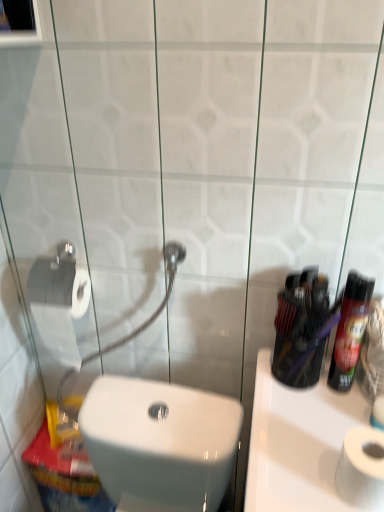
Where is `white glossy sink at right`? white glossy sink at right is located at coordinates (298, 442).

The image size is (384, 512). What do you see at coordinates (160, 443) in the screenshot?
I see `white glossy toilet at lower left` at bounding box center [160, 443].

The image size is (384, 512). Describe the element at coordinates (350, 330) in the screenshot. I see `shiny black spray can at right` at that location.

You are a GUI agent. You are given a task and a screenshot of the screen. Output one action in this format:
    pyautogui.click(x=<x>, y=<y>)
    Task: Click on the shiny black spray can at right
    The width and height of the screenshot is (384, 512).
    Given the screenshot: What is the action you would take?
    pyautogui.click(x=350, y=330)

Where is `translucent plastic mouthwash at center`? Image resolution: width=384 pixels, height=512 pixels. translucent plastic mouthwash at center is located at coordinates (300, 327).

You are a GUI agent. You are given a task and a screenshot of the screen. Output one action in this format:
    pyautogui.click(x=<x>, y=<y>)
    Task: Click on the white glossy sink at right
    
    Given the screenshot: What is the action you would take?
    pyautogui.click(x=298, y=442)

Between translucent plastic mouthwash at center and white glossy toilet at lower left, which one has larger size?

Bigger between the two is white glossy toilet at lower left.

Consider the image. How distant is translucent plastic mouthwash at center from white glossy toilet at lower left?

translucent plastic mouthwash at center and white glossy toilet at lower left are 12.53 inches apart from each other.

This screenshot has width=384, height=512. I want to click on toilet located underneath the translucent plastic mouthwash at center (from a real-world perspective), so click(x=160, y=443).

In the scene shown: Is translucent plastic mouthwash at center taller than white glossy toilet at lower left?

In fact, translucent plastic mouthwash at center may be shorter than white glossy toilet at lower left.

In the scene shown: Could you tell me if white glossy sink at right is turned towards shiny black spray can at right?

No, white glossy sink at right is not oriented towards shiny black spray can at right.

Considering the points (311, 478) and (358, 336), which point is in front, point (311, 478) or point (358, 336)?

Positioned in front is point (311, 478).

Considering the sizes of objects white glossy sink at right and shiny black spray can at right in the image provided, who is thinner, white glossy sink at right or shiny black spray can at right?

shiny black spray can at right is thinner.

From a real-world perspective, which object stands above the other?

In real-world perspective, shiny black spray can at right is above.

From a real-world perspective, does white glossy sink at right sit lower than white matte toilet paper at lower right?

Indeed, from a real-world perspective, white glossy sink at right is positioned beneath white matte toilet paper at lower right.

How far apart are white glossy sink at right and white matte toilet paper at lower right?

white glossy sink at right and white matte toilet paper at lower right are 5.07 inches apart.

Can white matte toilet paper at lower right be found inside white glossy sink at right?

No, white matte toilet paper at lower right is not inside white glossy sink at right.

Which is more to the left, white glossy sink at right or white matte toilet paper at lower right?

white matte toilet paper at lower right is more to the left.

Relative to white glossy sink at right, is shiny black spray can at right in front or behind?

In the image, shiny black spray can at right appears behind white glossy sink at right.

Is shiny black spray can at right positioned far away from white glossy sink at right?

Actually, shiny black spray can at right and white glossy sink at right are a little close together.

Does shiny black spray can at right have a smaller size compared to white glossy sink at right?

Yes, shiny black spray can at right is smaller than white glossy sink at right.

Is shiny black spray can at right oriented away from white glossy sink at right?

No.

In the scene shown: Is white matte toilet paper at lower right positioned with its back to white glossy toilet at lower left?

No, white matte toilet paper at lower right's orientation is not away from white glossy toilet at lower left.

From the image's perspective, which object appears higher, white matte toilet paper at lower right or white glossy toilet at lower left?

From the image's view, white matte toilet paper at lower right is above.

Based on their sizes in the image, would you say white matte toilet paper at lower right is bigger or smaller than white glossy toilet at lower left?

white matte toilet paper at lower right is smaller than white glossy toilet at lower left.

Is white matte toilet paper at lower right positioned beyond the bounds of white glossy toilet at lower left?

Indeed, white matte toilet paper at lower right is completely outside white glossy toilet at lower left.

In terms of width, does translucent plastic mouthwash at center look wider or thinner when compared to white glossy sink at right?

In the image, translucent plastic mouthwash at center appears to be more narrow than white glossy sink at right.

Would you consider translucent plastic mouthwash at center to be distant from white glossy sink at right?

No, there isn't a large distance between translucent plastic mouthwash at center and white glossy sink at right.

Is translucent plastic mouthwash at center to the left or to the right of white glossy sink at right in the image?

In the image, translucent plastic mouthwash at center appears on the left side of white glossy sink at right.

Between translucent plastic mouthwash at center and white glossy sink at right, which one is positioned in front?

white glossy sink at right is closer to the camera.

Locate an element on the screen. toilet paper in front of the translucent plastic mouthwash at center is located at coordinates (362, 468).

From the picture: Choose the correct answer: Is translucent plastic mouthwash at center inside white matte toilet paper at lower right or outside it?

translucent plastic mouthwash at center exists outside the volume of white matte toilet paper at lower right.

Which is in front, point (318, 323) or point (336, 480)?

The point (336, 480) is more forward.

From the image's perspective, which one is positioned lower, translucent plastic mouthwash at center or white matte toilet paper at lower right?

white matte toilet paper at lower right appears lower in the image.

I want to click on mouthwash that appears on the right of white glossy toilet at lower left, so click(300, 327).

Image resolution: width=384 pixels, height=512 pixels. Identify the location of cleaning product on the left of the white glossy sink at right. tap(350, 330).

Which object lies nearer to the anchor point shiny black spray can at right, white glossy toilet at lower left or translucent plastic mouthwash at center?

translucent plastic mouthwash at center is closer to shiny black spray can at right.

Estimate the real-world distances between objects in this image. Which object is closer to white matte toilet paper at lower right, shiny black spray can at right or translucent plastic mouthwash at center?

shiny black spray can at right is positioned closer to the anchor white matte toilet paper at lower right.

From the picture: Looking at the image, which one is located further to white glossy toilet at lower left, shiny black spray can at right or white glossy sink at right?

shiny black spray can at right is positioned further to the anchor white glossy toilet at lower left.

In the scene shown: From the image, which object appears to be farther from white matte toilet paper at lower right, white glossy toilet at lower left or translucent plastic mouthwash at center?

white glossy toilet at lower left is positioned further to the anchor white matte toilet paper at lower right.

Based on the photo, from the image, which object appears to be nearer to white matte toilet paper at lower right, shiny black spray can at right or white glossy sink at right?

Among the two, white glossy sink at right is located nearer to white matte toilet paper at lower right.

Based on their spatial positions, is white matte toilet paper at lower right or translucent plastic mouthwash at center further from white glossy sink at right?

translucent plastic mouthwash at center.

From the image, which object appears to be farther from white matte toilet paper at lower right, white glossy sink at right or white glossy toilet at lower left?

white glossy toilet at lower left lies further to white matte toilet paper at lower right than the other object.

When comparing their distances from white glossy sink at right, does white matte toilet paper at lower right or shiny black spray can at right seem further?

The object further to white glossy sink at right is shiny black spray can at right.

Locate an element on the screen. This screenshot has height=512, width=384. cleaning product between white matte toilet paper at lower right and translucent plastic mouthwash at center in the front-back direction is located at coordinates pyautogui.click(x=350, y=330).

Locate an element on the screen. toilet between shiny black spray can at right and white glossy sink at right in the up-down direction is located at coordinates (160, 443).

Where is `toilet between translucent plastic mouthwash at center and white glossy sink at right from top to bottom`? This screenshot has width=384, height=512. toilet between translucent plastic mouthwash at center and white glossy sink at right from top to bottom is located at coordinates (160, 443).

The image size is (384, 512). In order to click on toilet paper between translucent plastic mouthwash at center and white glossy sink at right in the vertical direction in this screenshot , I will do `click(362, 468)`.